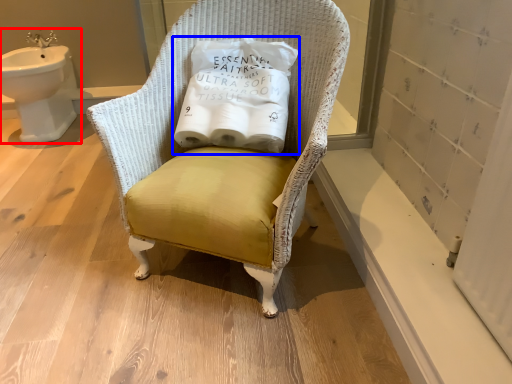
Question: Which point is further to the camera, sink (highlighted by a red box) or toilet paper (highlighted by a blue box)?

Choices:
 (A) sink
 (B) toilet paper

Answer: (A)